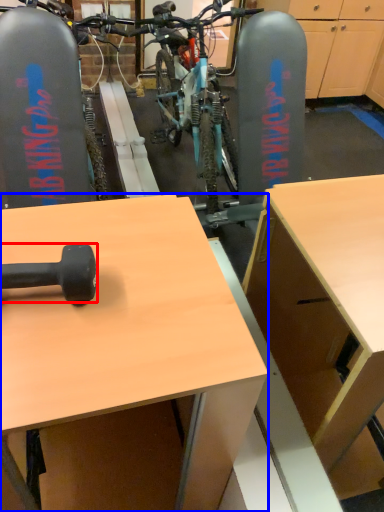
Question: Which object is further to the camera taking this photo, dumbbell (highlighted by a red box) or desk (highlighted by a blue box)?

Choices:
 (A) dumbbell
 (B) desk

Answer: (A)